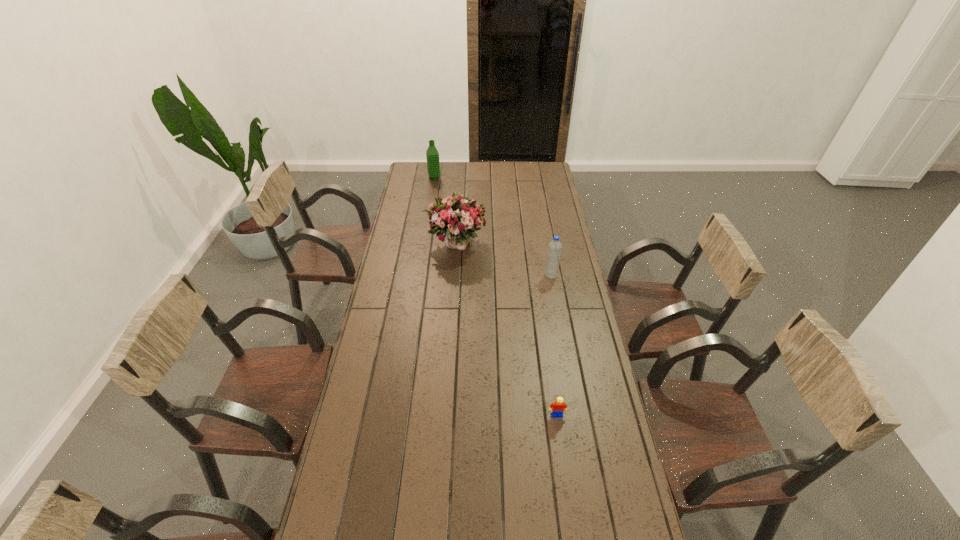
This screenshot has height=540, width=960. I want to click on the second farthest object, so click(457, 216).

This screenshot has height=540, width=960. I want to click on the farther water bottle, so click(x=433, y=167).

You are a GUI agent. You are given a task and a screenshot of the screen. Output one action in this format:
    pyautogui.click(x=<x>, y=<y>)
    Task: Click on the left water bottle
    The image size is (960, 540).
    Given the screenshot: What is the action you would take?
    pyautogui.click(x=433, y=167)

The height and width of the screenshot is (540, 960). I want to click on the second nearest object, so click(554, 250).

Find the location of a particular element. the right water bottle is located at coordinates (554, 250).

Where is `Lego`? This screenshot has height=540, width=960. Lego is located at coordinates (557, 408).

The image size is (960, 540). I want to click on the nearest object, so click(557, 408).

Image resolution: width=960 pixels, height=540 pixels. Identify the location of vacant space situated 0.250m on the front of the third nearest object. (451, 303).

This screenshot has height=540, width=960. Find the location of `free spot located 0.170m on the right of the farthest object`. free spot located 0.170m on the right of the farthest object is located at coordinates (470, 178).

Locate an element on the screen. Image resolution: width=960 pixels, height=540 pixels. vacant region located on the back of the second nearest object is located at coordinates (547, 254).